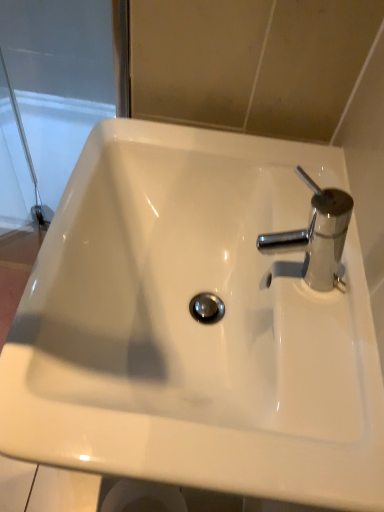
This screenshot has height=512, width=384. What do you see at coordinates (317, 234) in the screenshot? I see `chrome metallic faucet at upper right` at bounding box center [317, 234].

Where is `chrome metallic faucet at upper right`? The height and width of the screenshot is (512, 384). chrome metallic faucet at upper right is located at coordinates (317, 234).

You are a GUI agent. You are given a task and a screenshot of the screen. Output one action in this format:
    pyautogui.click(x=<x>, y=<y>)
    Task: Click on the chrome metallic faucet at upper right
    
    Given the screenshot: What is the action you would take?
    pyautogui.click(x=317, y=234)